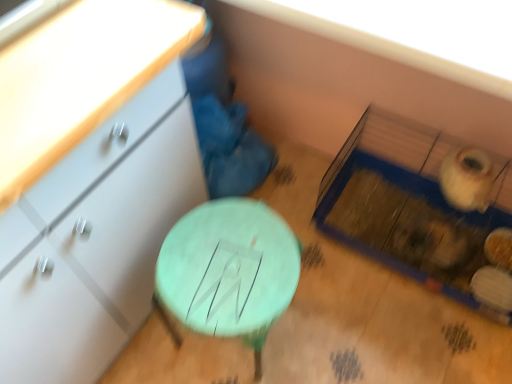
Question: From a real-world perspective, is green painted wood stool at center positioned under matte white chest of drawers at left based on gravity?

Choices:
 (A) no
 (B) yes

Answer: (B)

Question: Is green painted wood stool at center further to the viewer compared to matte white chest of drawers at left?

Choices:
 (A) no
 (B) yes

Answer: (B)

Question: Is the position of green painted wood stool at center less distant than that of matte white chest of drawers at left?

Choices:
 (A) yes
 (B) no

Answer: (B)

Question: Is green painted wood stool at center at the right side of matte white chest of drawers at left?

Choices:
 (A) yes
 (B) no

Answer: (A)

Question: Is green painted wood stool at center outside matte white chest of drawers at left?

Choices:
 (A) no
 (B) yes

Answer: (B)

Question: From the image's perspective, is green painted wood stool at center located above matte white chest of drawers at left?

Choices:
 (A) yes
 (B) no

Answer: (B)

Question: From the image's perspective, is matte white chest of drawers at left located above green painted wood stool at center?

Choices:
 (A) yes
 (B) no

Answer: (A)

Question: From the image's perspective, would you say matte white chest of drawers at left is shown under green painted wood stool at center?

Choices:
 (A) yes
 (B) no

Answer: (B)

Question: Is matte white chest of drawers at left taller than green painted wood stool at center?

Choices:
 (A) no
 (B) yes

Answer: (B)

Question: Is matte white chest of drawers at left completely or partially outside of green painted wood stool at center?

Choices:
 (A) yes
 (B) no

Answer: (A)

Question: Could green painted wood stool at center be considered to be inside matte white chest of drawers at left?

Choices:
 (A) yes
 (B) no

Answer: (B)

Question: From a real-world perspective, is matte white chest of drawers at left physically above green painted wood stool at center?

Choices:
 (A) no
 (B) yes

Answer: (B)

Question: From the image's perspective, is green painted wood stool at center located above or below matte white chest of drawers at left?

Choices:
 (A) above
 (B) below

Answer: (B)